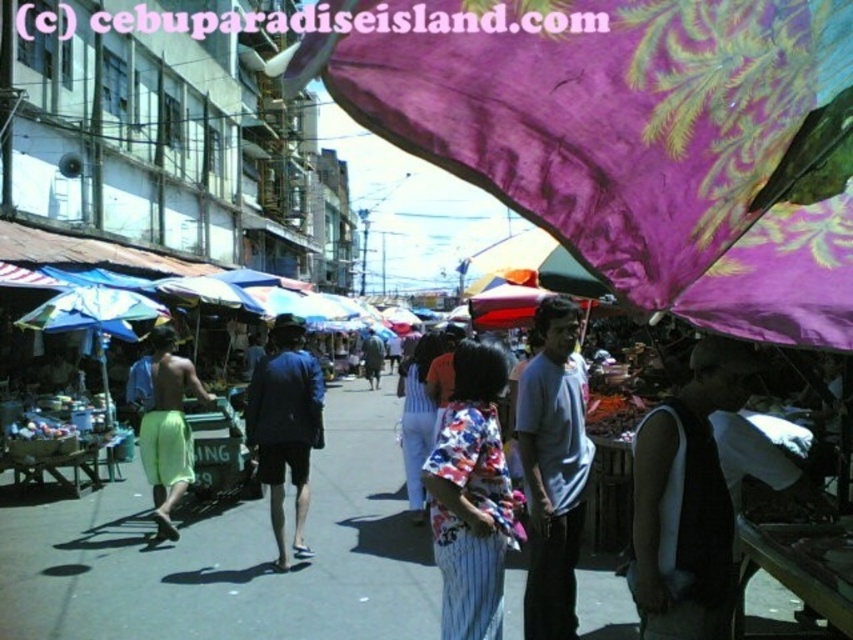
You are standing at the entrance of the street market and want to reach a specific point marked as point (677, 273). If you walk straight ahead, will you be able to reach this point within 5 feet?

The distance between point (677, 273) and the viewer is 6.24 feet, so you will not be able to reach it within 5 feet as it is farther than that.